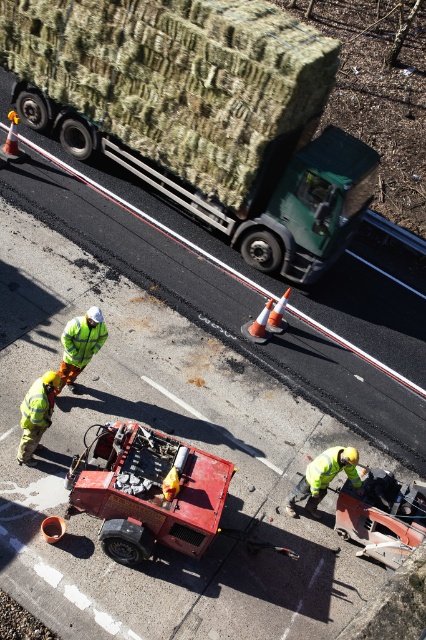
Which is in front, point (45, 401) or point (80, 344)?

Point (45, 401) is more forward.

Locate an element on the screen. This screenshot has height=640, width=426. reflective yellow safety vest at lower left is located at coordinates (36, 413).

You are a GUI agent. You are given a task and a screenshot of the screen. Output one action in this format:
    pyautogui.click(x=<x>, y=<y>)
    Task: Click on the reflective yellow safety vest at lower left
    
    Given the screenshot: What is the action you would take?
    pyautogui.click(x=36, y=413)

Who is positioned more to the right, high visibility yellow jacket at lower right or high visibility reflective jacket at center?

From the viewer's perspective, high visibility yellow jacket at lower right appears more on the right side.

Is point (307, 470) positioned behind point (86, 342)?

No, it is not.

You are a GUI agent. You are given a task and a screenshot of the screen. Output one action in this format:
    pyautogui.click(x=<x>, y=<y>)
    Task: Click on the high visibility yellow jacket at lower right
    
    Given the screenshot: What is the action you would take?
    pyautogui.click(x=324, y=477)

Between high visibility reflective jacket at center and green reflective safety vest at lower left, which one appears on the left side from the viewer's perspective?

high visibility reflective jacket at center

Is point (74, 353) closer to viewer compared to point (83, 317)?

No, it is not.

Measure the distance between point (69, 333) and camera.

The distance of point (69, 333) from camera is 8.29 meters.

Identify the location of high visibility reflective jacket at center. (80, 344).